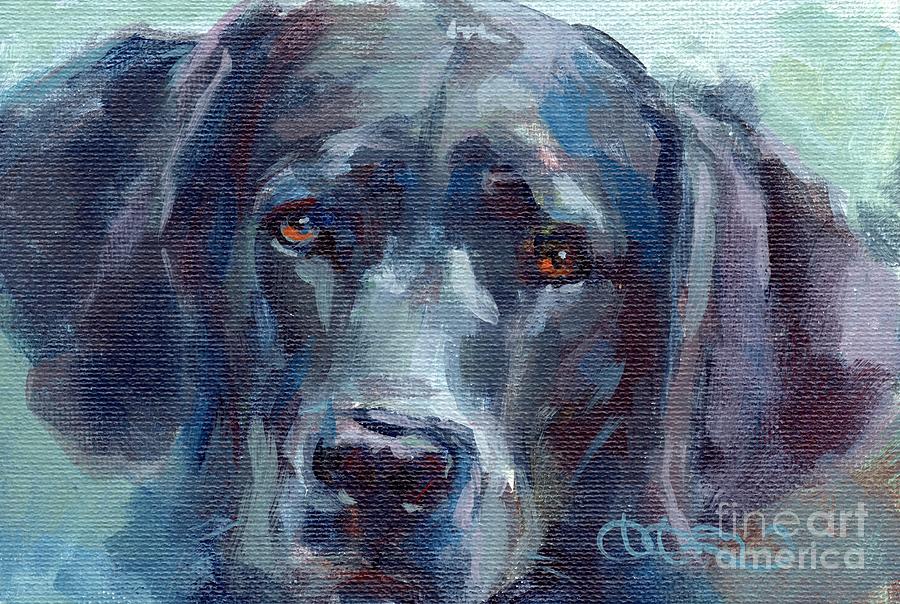
Where is `white paint`? This screenshot has width=900, height=604. white paint is located at coordinates (708, 10).